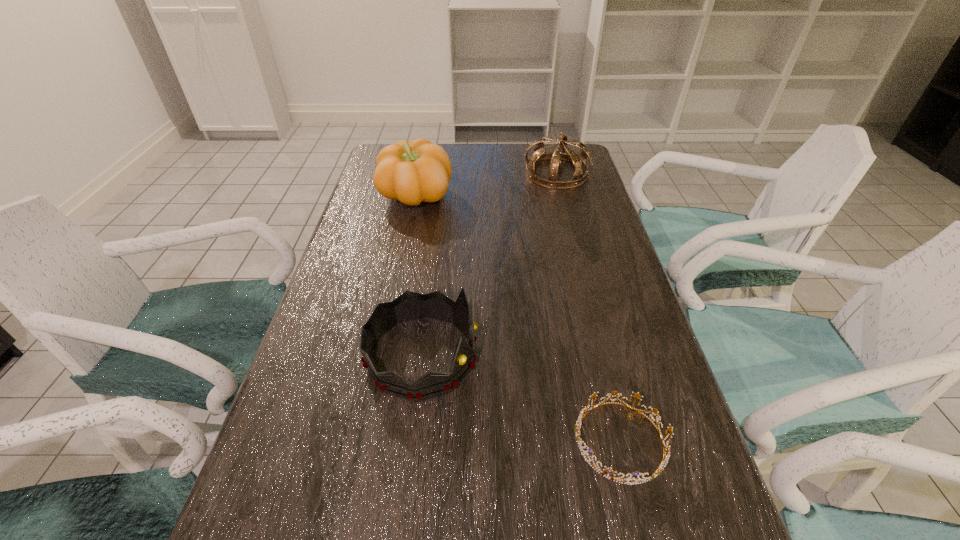
Identify which tiara is the nearest to the pumpkin. Please provide its 2D coordinates. Your answer should be formatted as a tuple, i.e. [(x, y)], where the tuple contains the x and y coordinates of a point satisfying the conditions above.

[(579, 161)]

Where is `free spot that satisfies the following two spatial constraints: 1. on the front side of the farthest tiara; 2. on the front-facing side of the shortest object`? The width and height of the screenshot is (960, 540). free spot that satisfies the following two spatial constraints: 1. on the front side of the farthest tiara; 2. on the front-facing side of the shortest object is located at coordinates (626, 441).